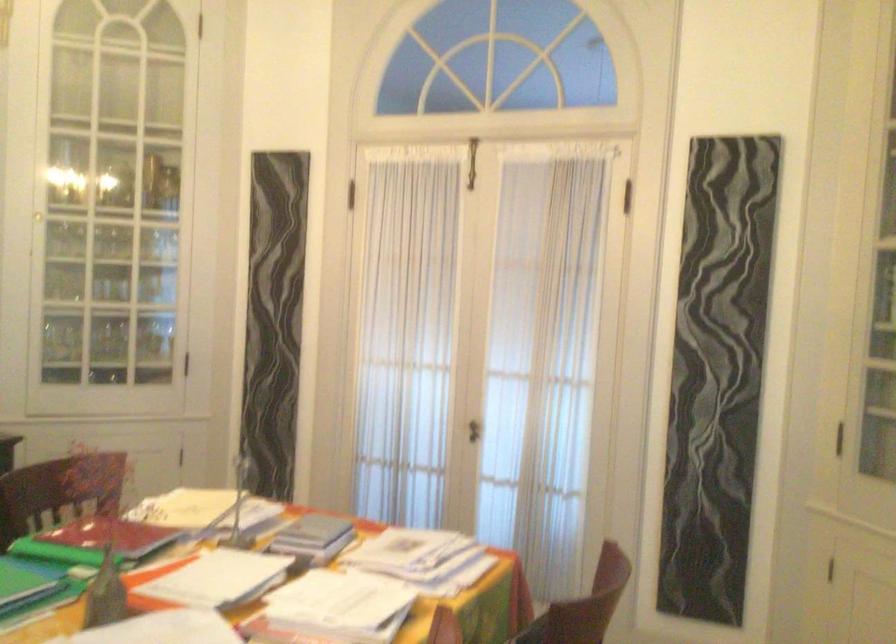
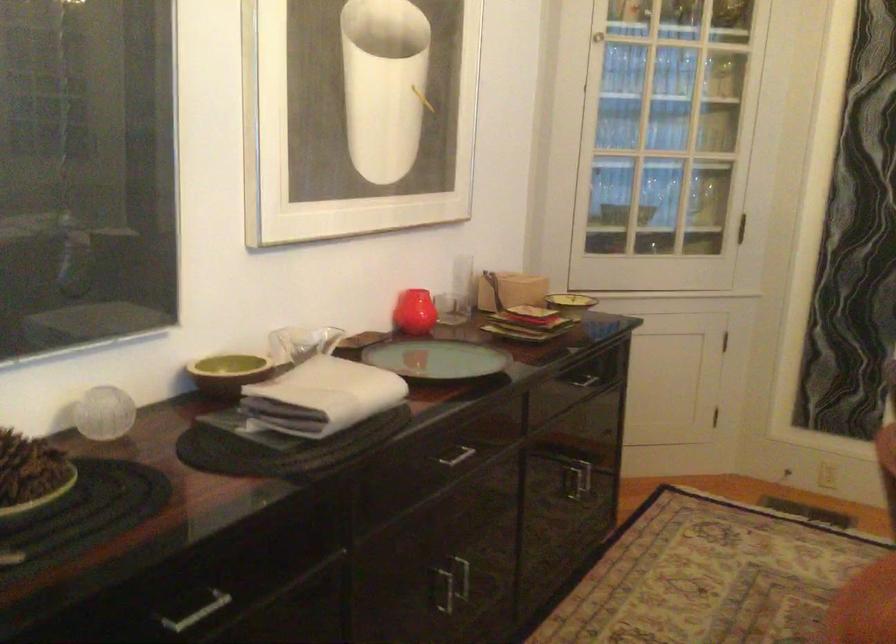
Find the pixel in the second image that matches the point at 170,207 in the first image.

(721, 77)